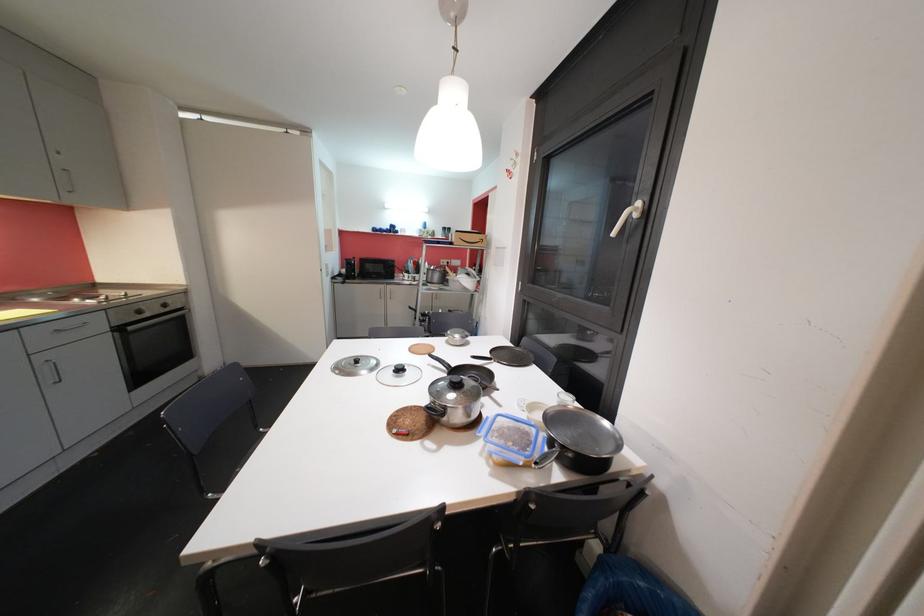
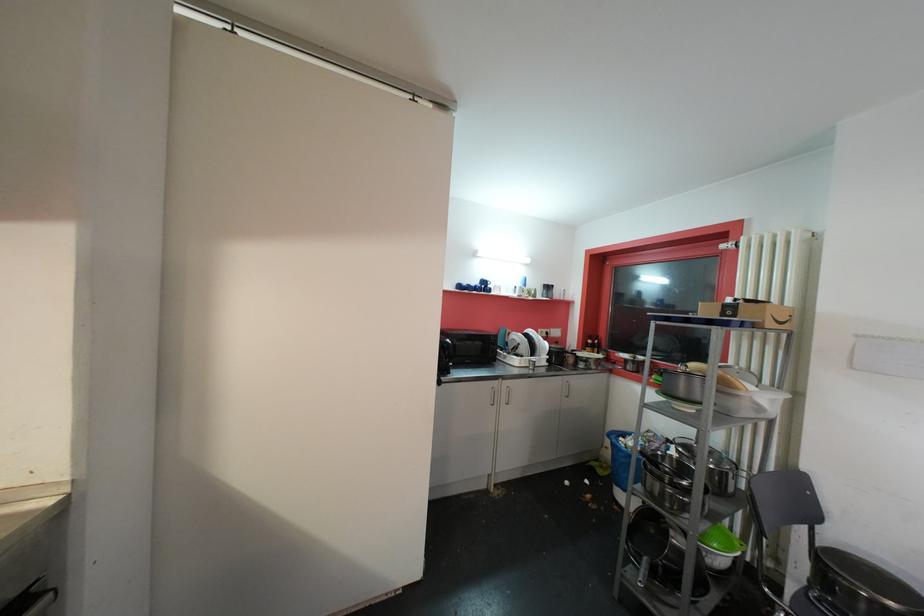
Locate, in the second image, the point that corresponds to [397,229] in the first image.

(489, 285)